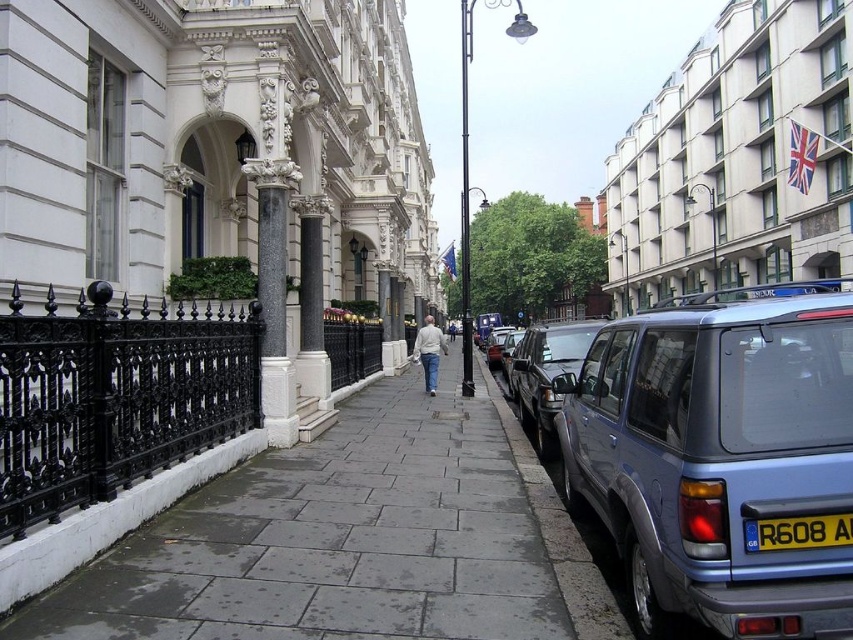
You are a delivery person trying to park your motorcycle between the black granite column at center and the metallic silver minivan at right. Can you safely fit your motorcycle there?

The black granite column at center is positioned over the metallic silver minivan at right, meaning the column is above the minivan. Since the column is overhead, there is no space between them for the motorcycle to park safely.

You are a delivery person trying to park your delivery van on the gray concrete sidewalk at center. The van requires a space that is at least as large as the metallic silver suv at center. Based on the scene, can you park there?

The gray concrete sidewalk at center is smaller than the metallic silver suv at center, so it cannot accommodate the delivery van which requires a space as large as the metallic silver suv at center.

You are standing at the entrance of the ornate building with the grand arched doorway. You want to take a photo of both point (258, 221) and point (548, 356) in the scene. Which point should you focus on first to ensure both are in clear view?

You should focus on point (258, 221) first because it is closer to the camera than point (548, 356), ensuring both points are in focus when using depth of field.